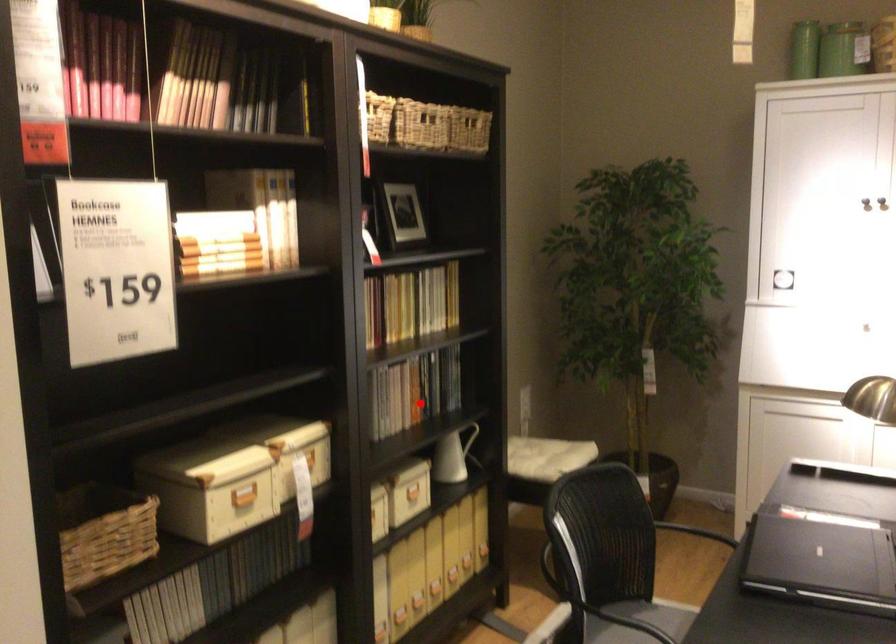
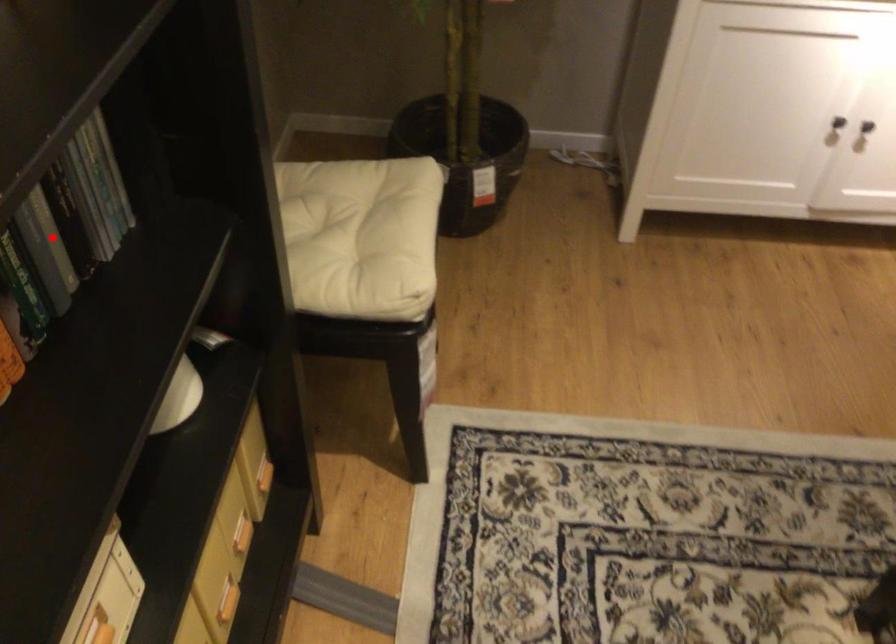
I am providing you with two images of the same scene from different viewpoints. A red point is marked on the first image and another point is marked on the second image. Do the highlighted points in image1 and image2 indicate the same real-world spot?

No